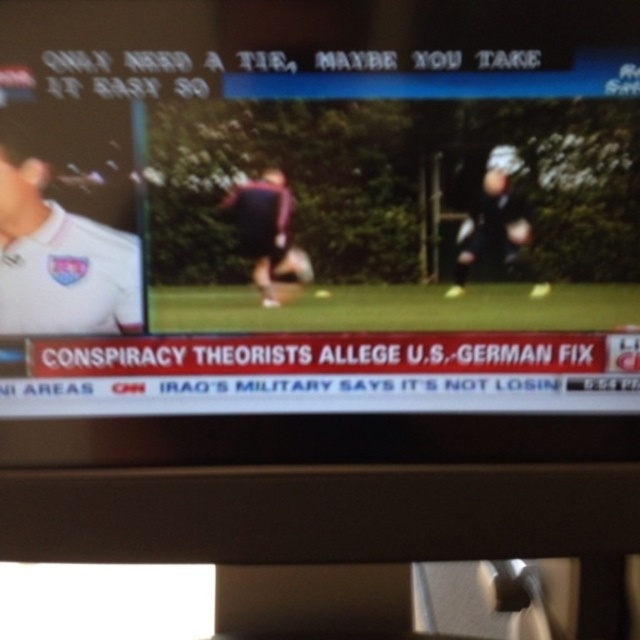
Question: Which point is farther to the camera?

Choices:
 (A) maroon jersey at center
 (B) white matte shirt at left

Answer: (A)

Question: Which point appears closest to the camera in this image?

Choices:
 (A) (60, 208)
 (B) (484, 224)

Answer: (A)

Question: From the image, what is the correct spatial relationship of maroon jersey at center in relation to dark blue uniform at right?

Choices:
 (A) above
 (B) below

Answer: (B)

Question: Which point is farther to the camera?

Choices:
 (A) (470, 252)
 (B) (273, 234)

Answer: (A)

Question: Can you confirm if maroon jersey at center is wider than dark blue uniform at right?

Choices:
 (A) no
 (B) yes

Answer: (A)

Question: Is white matte shirt at left behind dark blue uniform at right?

Choices:
 (A) no
 (B) yes

Answer: (A)